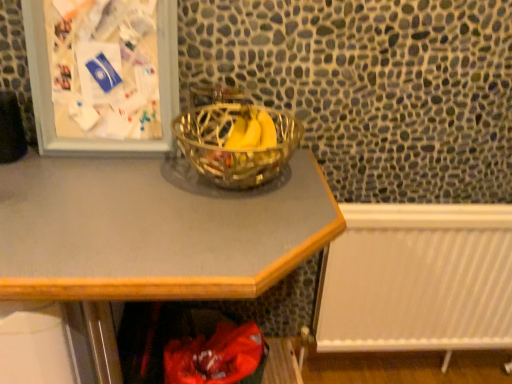
Question: From a real-world perspective, is white plastic radiator at lower right above or below metallic gray desk at center?

Choices:
 (A) above
 (B) below

Answer: (B)

Question: Is white plastic radiator at lower right in front of or behind metallic gray desk at center in the image?

Choices:
 (A) front
 (B) behind

Answer: (B)

Question: Based on their relative distances, which object is farther from the white plastic radiator at lower right?

Choices:
 (A) metallic gray desk at center
 (B) clear glass bowl at center
 (C) metallic silver picture frame at upper left

Answer: (C)

Question: Estimate the real-world distances between objects in this image. Which object is closer to the clear glass bowl at center?

Choices:
 (A) white plastic radiator at lower right
 (B) metallic gray desk at center
 (C) metallic silver picture frame at upper left

Answer: (B)